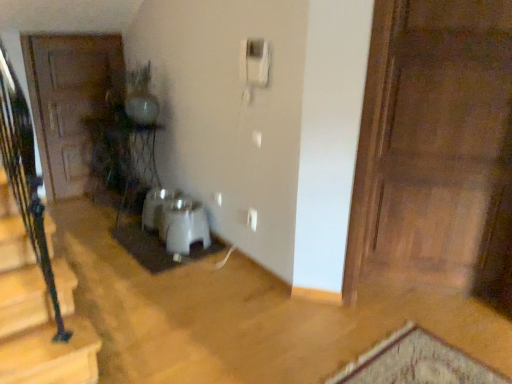
Where is `free location in front of wooden door at left, which ranks as the first door in back-to-front order`? The width and height of the screenshot is (512, 384). free location in front of wooden door at left, which ranks as the first door in back-to-front order is located at coordinates (80, 205).